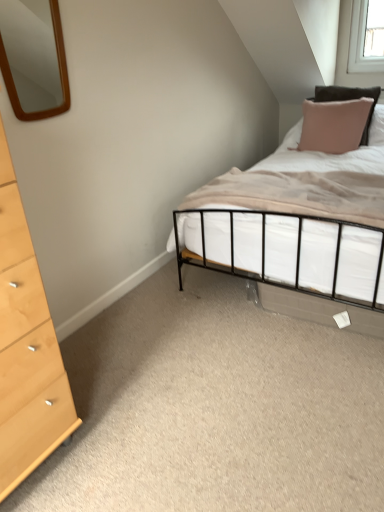
The image size is (384, 512). What do you see at coordinates (334, 125) in the screenshot? I see `pink fabric pillow at upper right` at bounding box center [334, 125].

What do you see at coordinates (31, 54) in the screenshot? This screenshot has width=384, height=512. I see `wooden mirror at upper left` at bounding box center [31, 54].

Consider the image. In order to face beige fabric mattress at center, should I rotate leftwards or rightwards?

Turn right by 13.004 degrees to look at beige fabric mattress at center.

This screenshot has width=384, height=512. Identify the location of pink fabric pillow at upper right. (334, 125).

Based on the photo, how far apart are beige fabric mattress at center and pink fabric pillow at upper right?

35.55 inches.

Is beige fabric mattress at center looking in the opposite direction of pink fabric pillow at upper right?

Yes, pink fabric pillow at upper right is at the back of beige fabric mattress at center.

How different are the orientations of beige fabric mattress at center and pink fabric pillow at upper right in degrees?

beige fabric mattress at center and pink fabric pillow at upper right are facing 2.05 degrees away from each other.

From the image's perspective, which is below, beige fabric mattress at center or pink fabric pillow at upper right?

From the image's view, beige fabric mattress at center is below.

Does beige fabric mattress at center have a lesser width compared to light wood/texture chest of drawers at left?

No.

Is beige fabric mattress at center facing towards light wood/texture chest of drawers at left?

Yes, beige fabric mattress at center is oriented towards light wood/texture chest of drawers at left.

From a real-world perspective, which object rests below the other?

In real-world perspective, beige fabric mattress at center is lower.

Between point (290, 208) and point (68, 389), which one is positioned in front?

Positioned in front is point (68, 389).

Which is behind, pink fabric pillow at upper right or wooden mirror at upper left?

pink fabric pillow at upper right is further away from the camera.

Does point (320, 135) lie in front of point (47, 56)?

Yes, point (320, 135) is closer to viewer.

Is pink fabric pillow at upper right situated inside wooden mirror at upper left or outside?

pink fabric pillow at upper right is not enclosed by wooden mirror at upper left.

Based on their sizes in the image, would you say pink fabric pillow at upper right is bigger or smaller than wooden mirror at upper left?

Clearly, pink fabric pillow at upper right is larger in size than wooden mirror at upper left.

From the image's perspective, which one is positioned higher, wooden mirror at upper left or beige fabric mattress at center?

From the image's view, wooden mirror at upper left is above.

Considering the relative sizes of wooden mirror at upper left and beige fabric mattress at center in the image provided, is wooden mirror at upper left thinner than beige fabric mattress at center?

Indeed, wooden mirror at upper left has a lesser width compared to beige fabric mattress at center.

Looking at this image, does light wood/texture chest of drawers at left turn towards beige fabric mattress at center?

No, light wood/texture chest of drawers at left is not oriented towards beige fabric mattress at center.

In the scene shown: From a real-world perspective, relative to beige fabric mattress at center, is light wood/texture chest of drawers at left vertically above or below?

Clearly, from a real-world perspective, light wood/texture chest of drawers at left is above beige fabric mattress at center.

Is light wood/texture chest of drawers at left surrounding beige fabric mattress at center?

No.

Considering the relative sizes of beige fabric mattress at center and wooden mirror at upper left in the image provided, is beige fabric mattress at center smaller than wooden mirror at upper left?

Incorrect, beige fabric mattress at center is not smaller in size than wooden mirror at upper left.

Can we say beige fabric mattress at center lies outside wooden mirror at upper left?

Yes, beige fabric mattress at center is not within wooden mirror at upper left.

Is beige fabric mattress at center positioned in front of wooden mirror at upper left?

That is False.

Which is behind, point (359, 214) or point (22, 81)?

The point (22, 81) is farther.

This screenshot has height=512, width=384. Identify the location of pillow behind the light wood/texture chest of drawers at left. (334, 125).

Are pink fabric pillow at upper right and light wood/texture chest of drawers at left far apart?

Yes.

Where is `mattress below the pink fabric pillow at upper right (from a real-world perspective)`? This screenshot has height=512, width=384. mattress below the pink fabric pillow at upper right (from a real-world perspective) is located at coordinates (297, 194).

Locate an element on the screen. The height and width of the screenshot is (512, 384). mattress that appears on the right of light wood/texture chest of drawers at left is located at coordinates (297, 194).

Looking at the image, which one is located further to pink fabric pillow at upper right, beige fabric mattress at center or light wood/texture chest of drawers at left?

light wood/texture chest of drawers at left is further to pink fabric pillow at upper right.

When comparing their distances from wooden mirror at upper left, does beige fabric mattress at center or pink fabric pillow at upper right seem closer?

Among the two, pink fabric pillow at upper right is located nearer to wooden mirror at upper left.

Looking at this image, which object lies nearer to the anchor point pink fabric pillow at upper right, wooden mirror at upper left or light wood/texture chest of drawers at left?

light wood/texture chest of drawers at left is closer to pink fabric pillow at upper right.

When comparing their distances from light wood/texture chest of drawers at left, does beige fabric mattress at center or pink fabric pillow at upper right seem further?

Based on the image, pink fabric pillow at upper right appears to be further to light wood/texture chest of drawers at left.

Estimate the real-world distances between objects in this image. Which object is closer to beige fabric mattress at center, pink fabric pillow at upper right or light wood/texture chest of drawers at left?

Among the two, pink fabric pillow at upper right is located nearer to beige fabric mattress at center.

In the scene shown: Estimate the real-world distances between objects in this image. Which object is further from beige fabric mattress at center, wooden mirror at upper left or light wood/texture chest of drawers at left?

Among the two, wooden mirror at upper left is located further to beige fabric mattress at center.

From the image, which object appears to be nearer to wooden mirror at upper left, light wood/texture chest of drawers at left or beige fabric mattress at center?

beige fabric mattress at center is positioned closer to the anchor wooden mirror at upper left.

From the picture: When comparing their distances from beige fabric mattress at center, does light wood/texture chest of drawers at left or pink fabric pillow at upper right seem further?

light wood/texture chest of drawers at left is further to beige fabric mattress at center.

Image resolution: width=384 pixels, height=512 pixels. Identify the location of mirror situated between light wood/texture chest of drawers at left and pink fabric pillow at upper right from left to right. (31, 54).

Find the location of a particular element. The width and height of the screenshot is (384, 512). mattress located between light wood/texture chest of drawers at left and pink fabric pillow at upper right in the depth direction is located at coordinates (297, 194).

Where is `mirror situated between light wood/texture chest of drawers at left and beige fabric mattress at center from left to right`? The height and width of the screenshot is (512, 384). mirror situated between light wood/texture chest of drawers at left and beige fabric mattress at center from left to right is located at coordinates pyautogui.click(x=31, y=54).

Find the location of `mattress between wooden mirror at upper left and pink fabric pillow at upper right from left to right`. mattress between wooden mirror at upper left and pink fabric pillow at upper right from left to right is located at coordinates (297, 194).